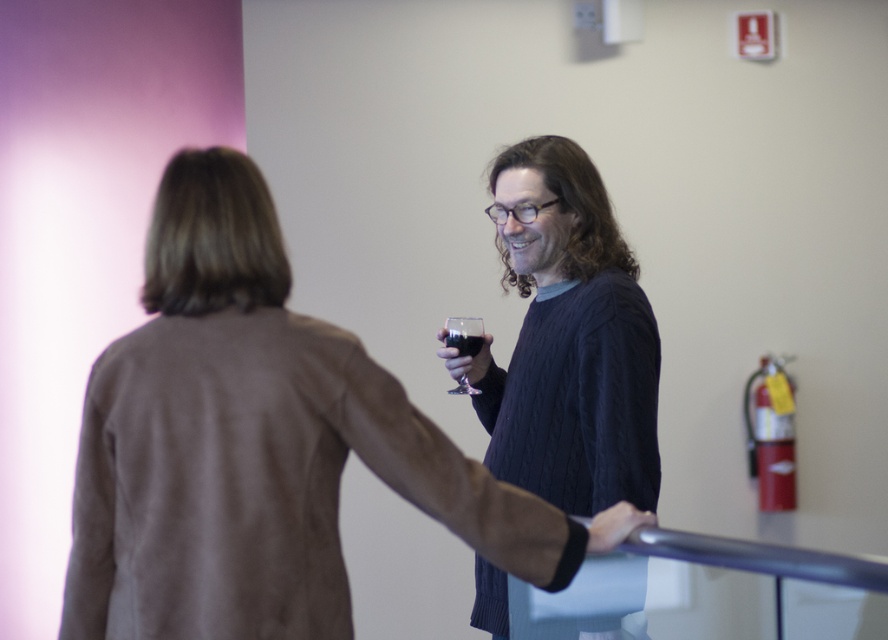
Is knitted sweater at center to the right of transparent glass at right from the viewer's perspective?

Indeed, knitted sweater at center is positioned on the right side of transparent glass at right.

Who is higher up, knitted sweater at center or transparent glass at right?

Positioned higher is transparent glass at right.

Who is more distant from viewer, (571, 205) or (456, 387)?

The point (456, 387) is behind.

Locate an element on the screen. knitted sweater at center is located at coordinates (567, 339).

Which is more to the left, brown suede jacket at center or knitted sweater at center?

Positioned to the left is brown suede jacket at center.

Is brown suede jacket at center smaller than knitted sweater at center?

Yes, brown suede jacket at center is smaller than knitted sweater at center.

The image size is (888, 640). I want to click on brown suede jacket at center, so click(259, 444).

Who is positioned more to the left, knitted sweater at center or translucent glass at center?

Positioned to the left is translucent glass at center.

Does point (593, 362) lie behind point (448, 330)?

No, (593, 362) is closer to viewer.

What do you see at coordinates (567, 339) in the screenshot? Image resolution: width=888 pixels, height=640 pixels. I see `knitted sweater at center` at bounding box center [567, 339].

Find the location of a particular element. This screenshot has width=888, height=640. knitted sweater at center is located at coordinates (567, 339).